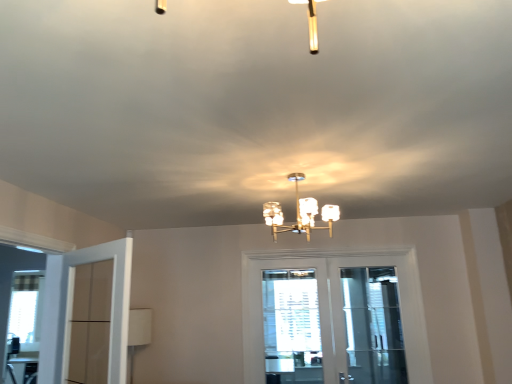
What are the coordinates of `matte glass chandelier at center` in the screenshot? It's located at (298, 213).

How much space does white matte door at left, which is counted as the 1th door, starting from the front, occupy vertically?

white matte door at left, which is counted as the 1th door, starting from the front, is 33.11 inches tall.

What is the approximate width of clear glass screen door at center?

3.24 inches.

Describe the element at coordinates (292, 327) in the screenshot. I see `white textured window at center` at that location.

What is the approximate height of white glossy door at center, which ranks as the first door in right-to-left order?

The height of white glossy door at center, which ranks as the first door in right-to-left order, is 3.88 feet.

Where is `white glossy door at center, the first door in the back-to-front sequence`? Image resolution: width=512 pixels, height=384 pixels. white glossy door at center, the first door in the back-to-front sequence is located at coordinates (330, 317).

Find the location of a particular element. The width and height of the screenshot is (512, 384). matte glass chandelier at center is located at coordinates (298, 213).

Are white textured window at center and white matte door at left, which is counted as the 1th door, starting from the front, making contact?

No.

From the picture: From the image's perspective, which is below, white textured window at center or white matte door at left, the second door positioned from the back?

white textured window at center, from the image's perspective.

From a real-world perspective, is white textured window at center on top of white matte door at left, arranged as the 1th door when viewed from the left?

Actually, white textured window at center is physically below white matte door at left, arranged as the 1th door when viewed from the left, in the real world.

Can you confirm if white textured window at center is shorter than white matte door at left, the 2th door viewed from the right?

No.

From the picture: From a real-world perspective, which is physically below, white matte door at left, which is counted as the 1th door, starting from the front, or clear glass screen door at center?

clear glass screen door at center, from a real-world perspective.

Is point (118, 349) positioned before point (361, 330)?

That is True.

Is white matte door at left, the 2th door viewed from the right, next to clear glass screen door at center?

There is a gap between white matte door at left, the 2th door viewed from the right, and clear glass screen door at center.

Is matte glass chandelier at center at the back of clear glass screen door at center?

No, matte glass chandelier at center is not at the back of clear glass screen door at center.

Which object is closer to the camera taking this photo, clear glass screen door at center or matte glass chandelier at center?

matte glass chandelier at center.

From a real-world perspective, between clear glass screen door at center and matte glass chandelier at center, who is vertically higher?

matte glass chandelier at center, from a real-world perspective.

Considering the relative sizes of white textured window at center and white glossy door at center, the first door in the back-to-front sequence, in the image provided, is white textured window at center shorter than white glossy door at center, the first door in the back-to-front sequence,?

Yes.

Identify the location of door that is the 1st one when counting upward from the white textured window at center (from the image's perspective). The width and height of the screenshot is (512, 384). (330, 317).

Could you tell me if white textured window at center is turned towards white glossy door at center, which ranks as the first door in right-to-left order?

Yes, white textured window at center is aimed at white glossy door at center, which ranks as the first door in right-to-left order.

Which object is closer to the camera taking this photo, white textured window at center or white glossy door at center, which ranks as the first door in right-to-left order?

white glossy door at center, which ranks as the first door in right-to-left order, is in front.

From a real-world perspective, is white matte door at left, the 2th door viewed from the right, physically located above or below white textured window at center?

From a real-world perspective, white matte door at left, the 2th door viewed from the right, is physically above white textured window at center.

Is white textured window at center surrounded by white matte door at left, arranged as the 1th door when viewed from the left?

No, white textured window at center is located outside of white matte door at left, arranged as the 1th door when viewed from the left.

Is white matte door at left, the 2th door viewed from the right, not near white textured window at center?

Yes, white matte door at left, the 2th door viewed from the right, and white textured window at center are located far from each other.

Looking at this image, could you tell me if white matte door at left, the second door positioned from the back, is turned towards white textured window at center?

Yes, white matte door at left, the second door positioned from the back, is turned towards white textured window at center.

Choose the correct answer: Is white glossy door at center, which ranks as the first door in right-to-left order, inside white matte door at left, arranged as the 1th door when viewed from the left, or outside it?

The correct answer is: outside.

From the image's perspective, which is below, white glossy door at center, the first door in the back-to-front sequence, or white matte door at left, which is counted as the 1th door, starting from the front?

white glossy door at center, the first door in the back-to-front sequence.

Is white glossy door at center, which ranks as the first door in right-to-left order, touching white matte door at left, arranged as the 1th door when viewed from the left?

No, white glossy door at center, which ranks as the first door in right-to-left order, is not beside white matte door at left, arranged as the 1th door when viewed from the left.

Considering the relative positions of white glossy door at center, the first door in the back-to-front sequence, and white matte door at left, arranged as the 1th door when viewed from the left, in the image provided, is white glossy door at center, the first door in the back-to-front sequence, to the left or to the right of white matte door at left, arranged as the 1th door when viewed from the left,?

Based on their positions, white glossy door at center, the first door in the back-to-front sequence, is located to the right of white matte door at left, arranged as the 1th door when viewed from the left.

From a real-world perspective, is clear glass screen door at center located higher than white textured window at center?

Yes, from a real-world perspective, clear glass screen door at center is over white textured window at center

Which of these two, clear glass screen door at center or white textured window at center, is wider?

With larger width is clear glass screen door at center.

Can you confirm if clear glass screen door at center is bigger than white textured window at center?

Yes, clear glass screen door at center is bigger than white textured window at center.

Is clear glass screen door at center taller than white textured window at center?

Yes, clear glass screen door at center is taller than white textured window at center.

You are a GUI agent. You are given a task and a screenshot of the screen. Output one action in this format:
    pyautogui.click(x=<x>, y=<y>)
    Task: Click on the window on the right of the white matte door at left, the 2th door viewed from the right
    
    Given the screenshot: What is the action you would take?
    pyautogui.click(x=292, y=327)

I want to click on screen door below the white matte door at left, arranged as the 1th door when viewed from the left (from a real-world perspective), so click(373, 326).

From the image, which object appears to be farther from white textured window at center, matte glass chandelier at center or white glossy door at center, which is counted as the 2th door, starting from the left?

A: matte glass chandelier at center lies further to white textured window at center than the other object.

When comparing their distances from white matte door at left, the second door positioned from the back, does matte glass chandelier at center or white textured window at center seem closer?

Among the two, matte glass chandelier at center is located nearer to white matte door at left, the second door positioned from the back.

In the scene shown: From the image, which object appears to be nearer to clear glass screen door at center, white textured window at center or matte glass chandelier at center?

white textured window at center.

When comparing their distances from matte glass chandelier at center, does white textured window at center or white glossy door at center, the 2th door from the front, seem closer?

The object closer to matte glass chandelier at center is white textured window at center.

Estimate the real-world distances between objects in this image. Which object is closer to white matte door at left, which is counted as the 1th door, starting from the front, white textured window at center or white glossy door at center, the first door in the back-to-front sequence?

Based on the image, white textured window at center appears to be nearer to white matte door at left, which is counted as the 1th door, starting from the front.

Which object lies further to the anchor point clear glass screen door at center, white glossy door at center, which ranks as the first door in right-to-left order, or white matte door at left, arranged as the 1th door when viewed from the left?

white matte door at left, arranged as the 1th door when viewed from the left, is positioned further to the anchor clear glass screen door at center.

Which object lies nearer to the anchor point matte glass chandelier at center, white matte door at left, arranged as the 1th door when viewed from the left, or clear glass screen door at center?

Among the two, clear glass screen door at center is located nearer to matte glass chandelier at center.

From the image, which object appears to be farther from white matte door at left, the second door positioned from the back, clear glass screen door at center or white textured window at center?

clear glass screen door at center is further to white matte door at left, the second door positioned from the back.

You are a GUI agent. You are given a task and a screenshot of the screen. Output one action in this format:
    pyautogui.click(x=<x>, y=<y>)
    Task: Click on the door between white matte door at left, which is counted as the 1th door, starting from the front, and clear glass screen door at center
    The width and height of the screenshot is (512, 384).
    Given the screenshot: What is the action you would take?
    pyautogui.click(x=330, y=317)

This screenshot has height=384, width=512. In order to click on screen door positioned between matte glass chandelier at center and white textured window at center from near to far in this screenshot , I will do `click(373, 326)`.

You are a GUI agent. You are given a task and a screenshot of the screen. Output one action in this format:
    pyautogui.click(x=<x>, y=<y>)
    Task: Click on the lamp between white matte door at left, the second door positioned from the back, and clear glass screen door at center
    This screenshot has height=384, width=512.
    Given the screenshot: What is the action you would take?
    tap(298, 213)

The width and height of the screenshot is (512, 384). What are the coordinates of `window between white matte door at left, which is counted as the 1th door, starting from the front, and clear glass screen door at center, in the horizontal direction` in the screenshot? It's located at point(292,327).